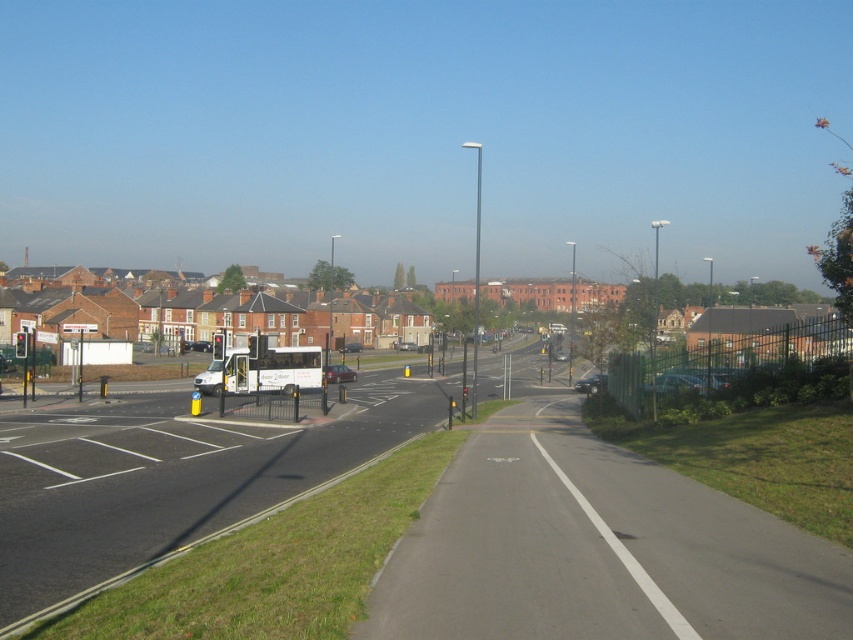
Is point (350, 352) positioned in front of point (566, 358)?

That is True.

Between matte black car at center and metallic silver car at center, which one appears on the left side from the viewer's perspective?

Positioned to the left is matte black car at center.

Is point (357, 348) closer to viewer compared to point (558, 358)?

No, (357, 348) is further to viewer.

Identify the location of matte black car at center. (352, 348).

Does white matte van at center have a larger size compared to matte black car at center?

No.

Does white matte van at center have a lesser width compared to matte black car at center?

Yes, white matte van at center is thinner than matte black car at center.

Identify the location of white matte van at center. The height and width of the screenshot is (640, 853). (201, 346).

Find the location of a particular element. Image resolution: width=853 pixels, height=640 pixels. white matte van at center is located at coordinates (201, 346).

Which is more to the left, white matte bus at center or metallic silver car at center?

white matte bus at center

Who is shorter, white matte bus at center or metallic silver car at center?

metallic silver car at center

Measure the distance between point (317, 365) and camera.

They are 51.72 meters apart.

Image resolution: width=853 pixels, height=640 pixels. Find the location of `white matte bus at center`. white matte bus at center is located at coordinates (273, 369).